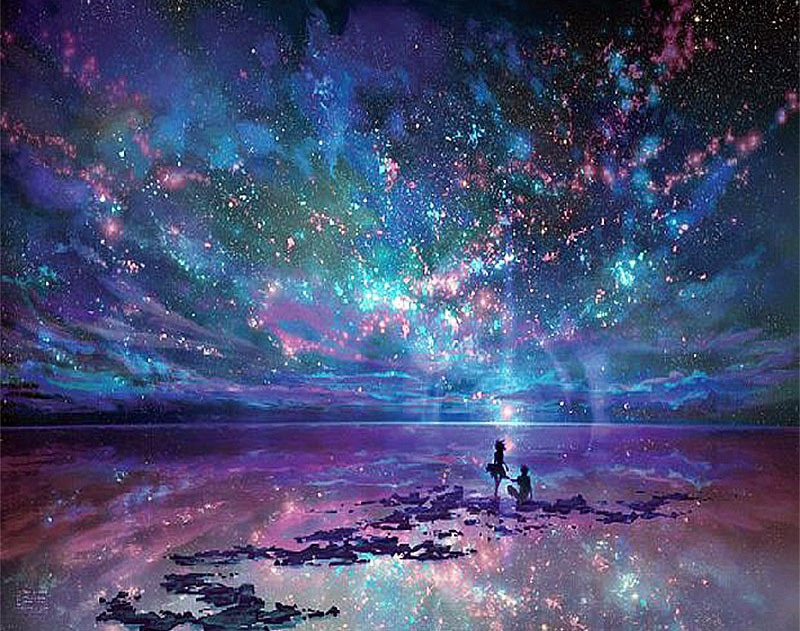
Where is `artwork`? This screenshot has width=800, height=631. artwork is located at coordinates (210, 360).